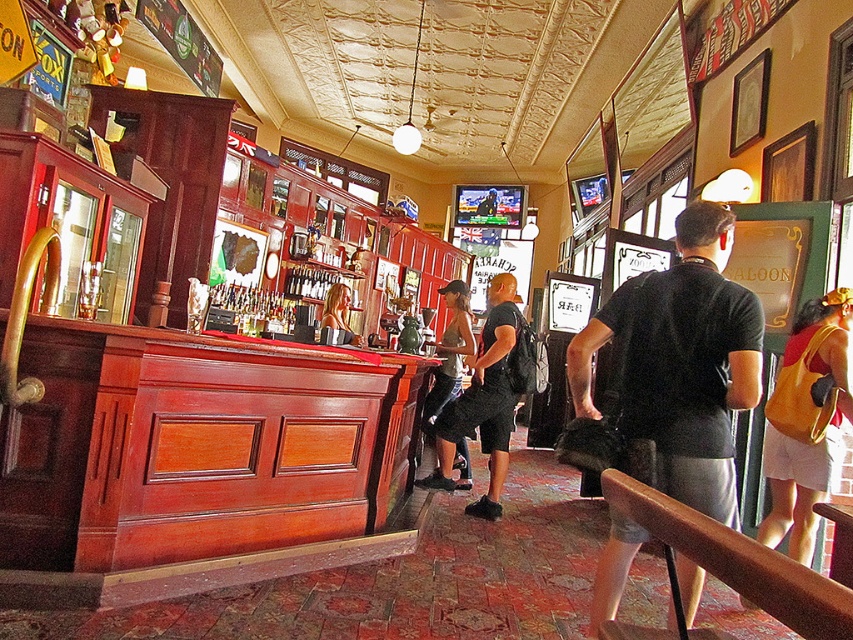
This screenshot has width=853, height=640. In order to click on black mesh backpack at center in this screenshot , I will do `click(482, 403)`.

Which is in front, point (509, 385) or point (331, 300)?

Point (509, 385) is more forward.

Measure the distance between black mesh backpack at center and camera.

The distance of black mesh backpack at center from camera is 4.39 meters.

What are the coordinates of `black mesh backpack at center` in the screenshot? It's located at (482, 403).

Is brown wood at lower right closer to the viewer compared to smooth blonde hair at center?

Yes.

In the scene shown: Is brown wood at lower right to the right of smooth blonde hair at center from the viewer's perspective?

Correct, you'll find brown wood at lower right to the right of smooth blonde hair at center.

Is point (682, 522) farther from camera compared to point (341, 285)?

No, (682, 522) is in front of (341, 285).

This screenshot has height=640, width=853. Identify the location of brown wood at lower right. (735, 563).

Which is behind, point (734, 352) or point (334, 284)?

Point (334, 284)

Consider the image. Who is taller, black matte shirt at center or smooth blonde hair at center?

black matte shirt at center is taller.

Who is more distant from viewer, (740, 381) or (343, 292)?

The point (343, 292) is behind.

Find the location of a particular element. The width and height of the screenshot is (853, 640). black matte shirt at center is located at coordinates (683, 362).